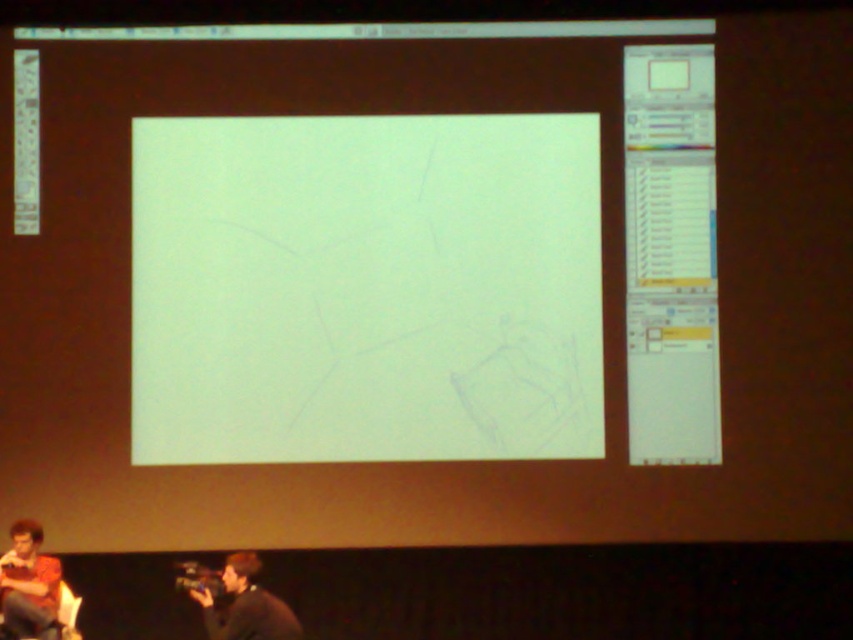
Question: Is matte orange shirt at lower left to the right of dark gray sweater at lower center from the viewer's perspective?

Choices:
 (A) no
 (B) yes

Answer: (A)

Question: Which object is positioned farthest from the white paper at center?

Choices:
 (A) dark gray sweater at lower center
 (B) matte orange shirt at lower left

Answer: (B)

Question: Is white paper at center thinner than matte orange shirt at lower left?

Choices:
 (A) yes
 (B) no

Answer: (B)

Question: Estimate the real-world distances between objects in this image. Which object is closer to the matte orange shirt at lower left?

Choices:
 (A) dark gray sweater at lower center
 (B) white paper at center

Answer: (A)

Question: Can you confirm if white paper at center is wider than matte orange shirt at lower left?

Choices:
 (A) yes
 (B) no

Answer: (A)

Question: Based on their relative distances, which object is nearer to the white paper at center?

Choices:
 (A) matte orange shirt at lower left
 (B) dark gray sweater at lower center

Answer: (B)